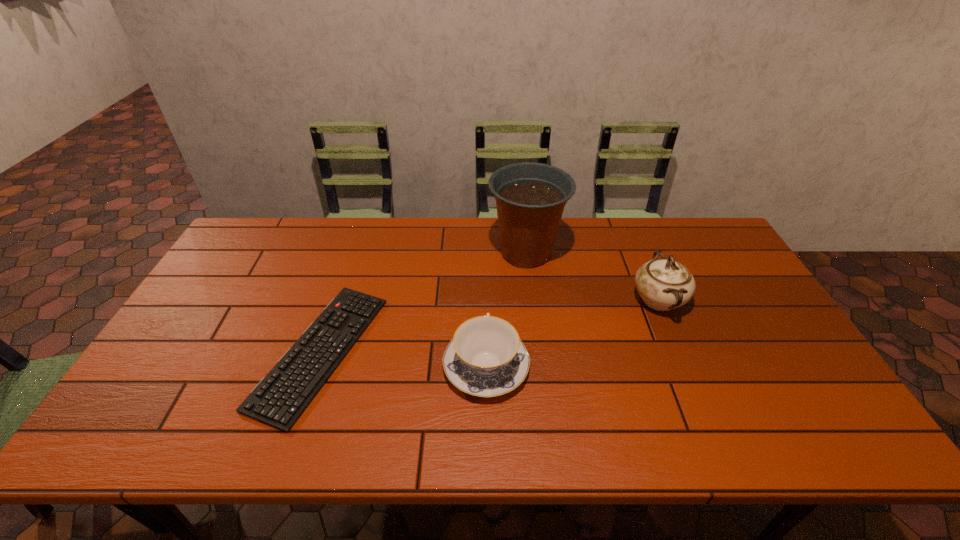
This screenshot has width=960, height=540. I want to click on flowerpot, so click(530, 197).

At what (x,y) coordinates should I click in order to perform the action: click on the taller chinaware. Please return your answer as a coordinate pair (x, y). This screenshot has height=540, width=960. Looking at the image, I should click on tap(664, 284).

This screenshot has height=540, width=960. Identify the location of the right chinaware. (664, 284).

Find the location of a particular element. the nearer chinaware is located at coordinates (486, 358).

Identify the location of the third tallest object. The width and height of the screenshot is (960, 540). (486, 358).

Find the location of `the leftmost object`. the leftmost object is located at coordinates (280, 398).

Where is `computer keyboard`? computer keyboard is located at coordinates (280, 398).

Where is `free space located 0.110m on the front of the tallest object`? Image resolution: width=960 pixels, height=540 pixels. free space located 0.110m on the front of the tallest object is located at coordinates (x=532, y=303).

Locate an element on the screen. This screenshot has height=540, width=960. vacant space situated on the right of the taller chinaware is located at coordinates tap(740, 300).

Identify the location of free region located 0.360m with the handle on the side of the nearer chinaware. (485, 251).